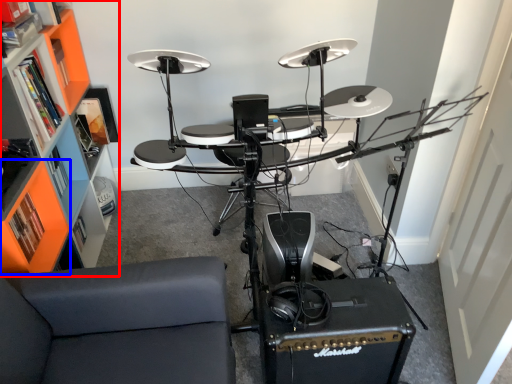
Question: Which object is closer to the camera taking this photo, bookshelf (highlighted by a red box) or shelf (highlighted by a blue box)?

Choices:
 (A) bookshelf
 (B) shelf

Answer: (A)